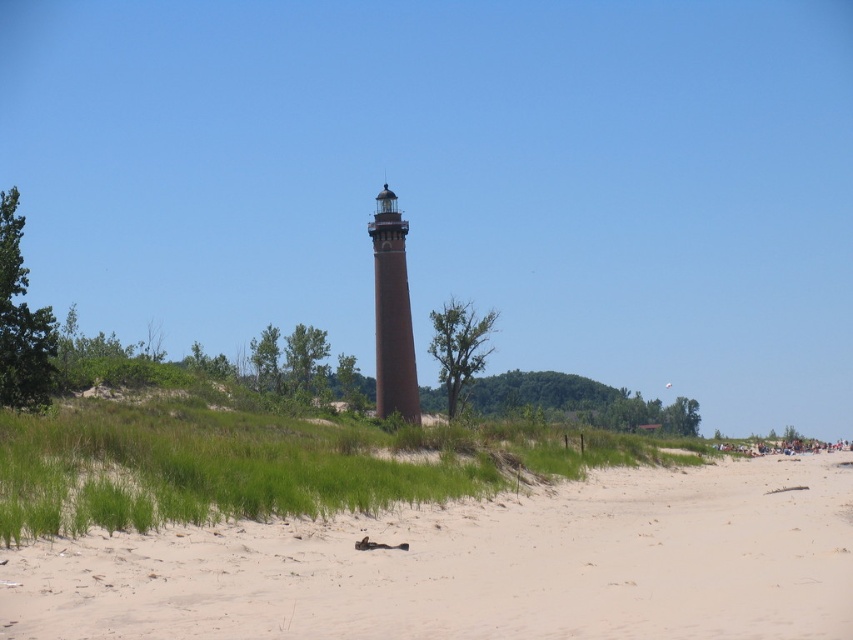
Question: Does sandy beach at center appear on the right side of brown matte tower at center?

Choices:
 (A) no
 (B) yes

Answer: (B)

Question: Which point is closer to the camera?

Choices:
 (A) brown matte tower at center
 (B) sandy beach at center

Answer: (B)

Question: Is sandy beach at center positioned in front of brown matte tower at center?

Choices:
 (A) no
 (B) yes

Answer: (B)

Question: Which point appears farthest from the camera in this image?

Choices:
 (A) (392, 196)
 (B) (451, 582)

Answer: (A)

Question: Is sandy beach at center closer to camera compared to brown matte tower at center?

Choices:
 (A) yes
 (B) no

Answer: (A)